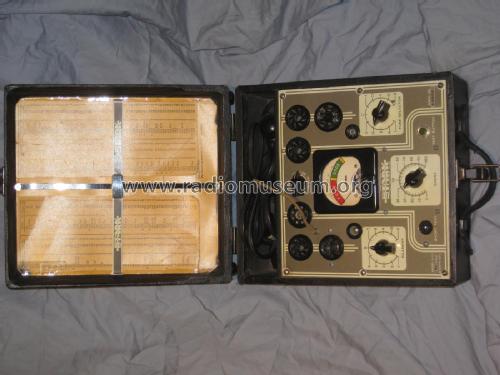
The image size is (500, 375). Find the location of `hinge`. hinge is located at coordinates (233, 127), (233, 235).